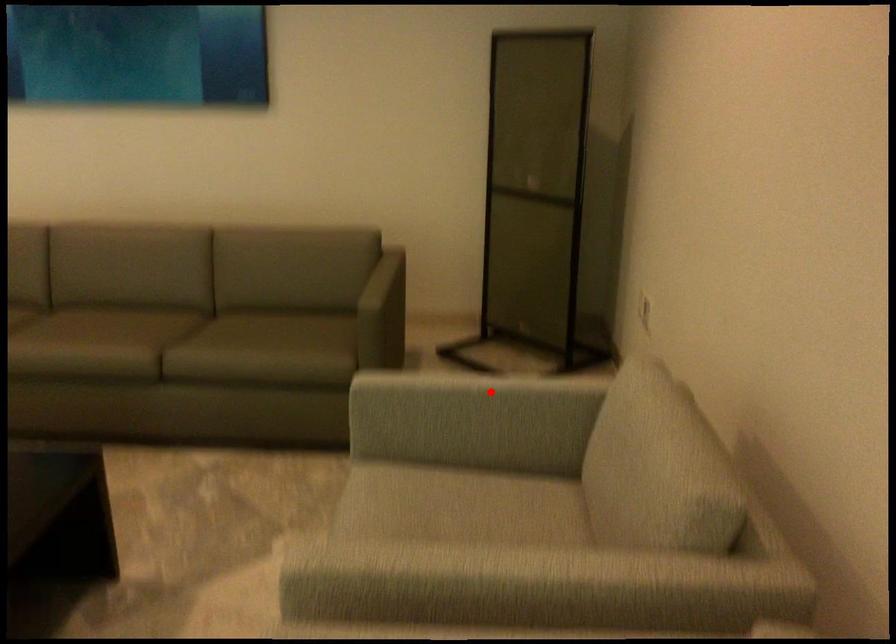
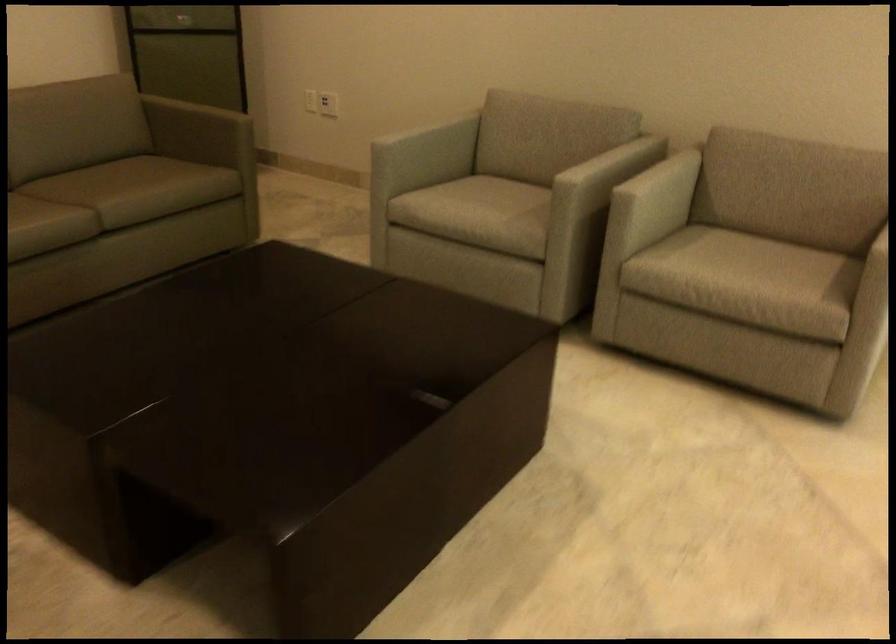
Find the pixel in the second image that matches the highlighted location in the first image.

(423, 127)